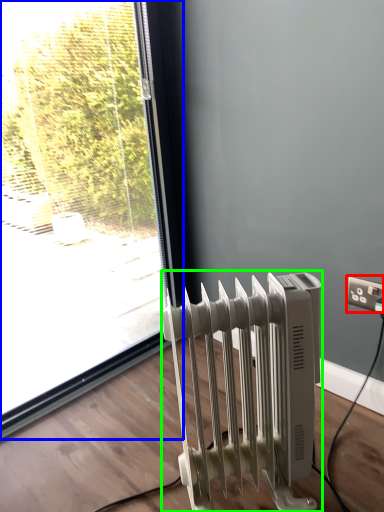
Question: Considering the real-world distances, which object is farthest from electric outlet (highlighted by a red box)? window (highlighted by a blue box) or radiator (highlighted by a green box)?

Choices:
 (A) window
 (B) radiator

Answer: (A)